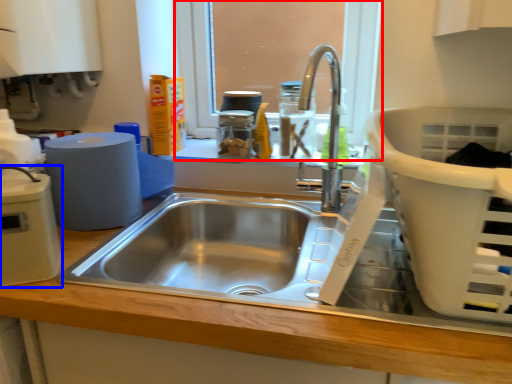
Question: Which object appears closest to the camera in this image, window screen (highlighted by a red box) or appliance (highlighted by a blue box)?

Choices:
 (A) window screen
 (B) appliance

Answer: (B)